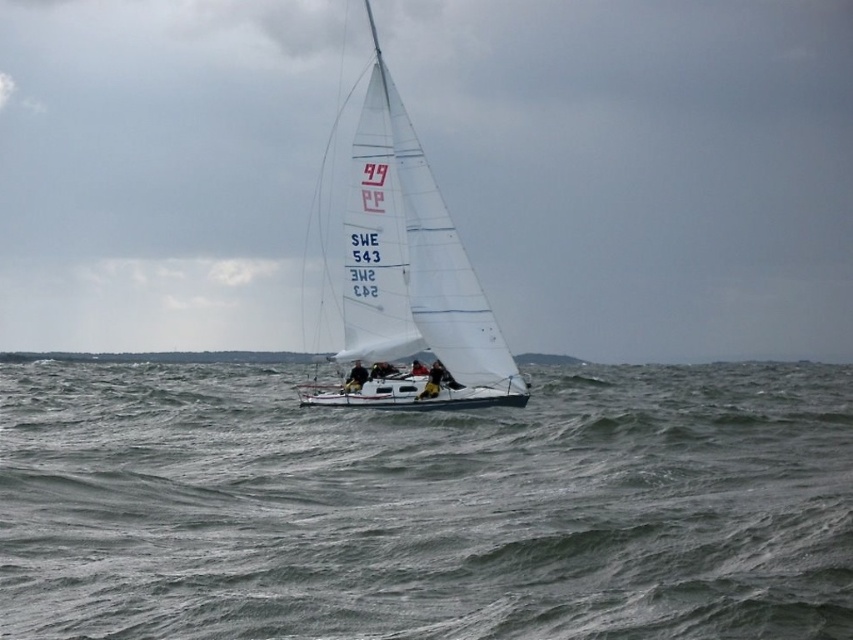
Is point (396, 500) positioned in front of point (416, 400)?

Yes, point (396, 500) is closer to viewer.

Does gray water at center have a lesser width compared to white matte sailboat at center?

In fact, gray water at center might be wider than white matte sailboat at center.

Which is in front, point (792, 420) or point (408, 285)?

Point (792, 420) is in front.

Identify the location of gray water at center. (425, 508).

Which of these two, white sailboat at center or gray water at center, stands shorter?

Standing shorter between the two is gray water at center.

Is white sailboat at center to the right of gray water at center from the viewer's perspective?

Yes, white sailboat at center is to the right of gray water at center.

Does point (630, 124) come closer to viewer compared to point (442, 536)?

No, it is not.

Where is `white sailboat at center`? white sailboat at center is located at coordinates (643, 166).

Does white sailboat at center have a greater height compared to white matte sailboat at center?

Indeed, white sailboat at center has a greater height compared to white matte sailboat at center.

Can you confirm if white sailboat at center is shorter than white matte sailboat at center?

No, white sailboat at center is not shorter than white matte sailboat at center.

Which is behind, point (469, 228) or point (352, 200)?

The point (469, 228) is behind.

The image size is (853, 640). What are the coordinates of `white sailboat at center` in the screenshot? It's located at (643, 166).